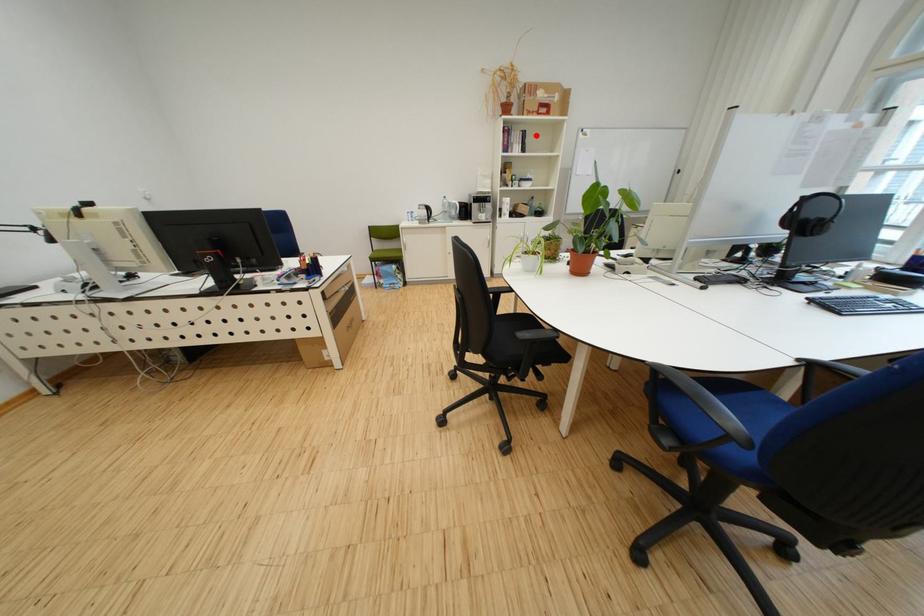
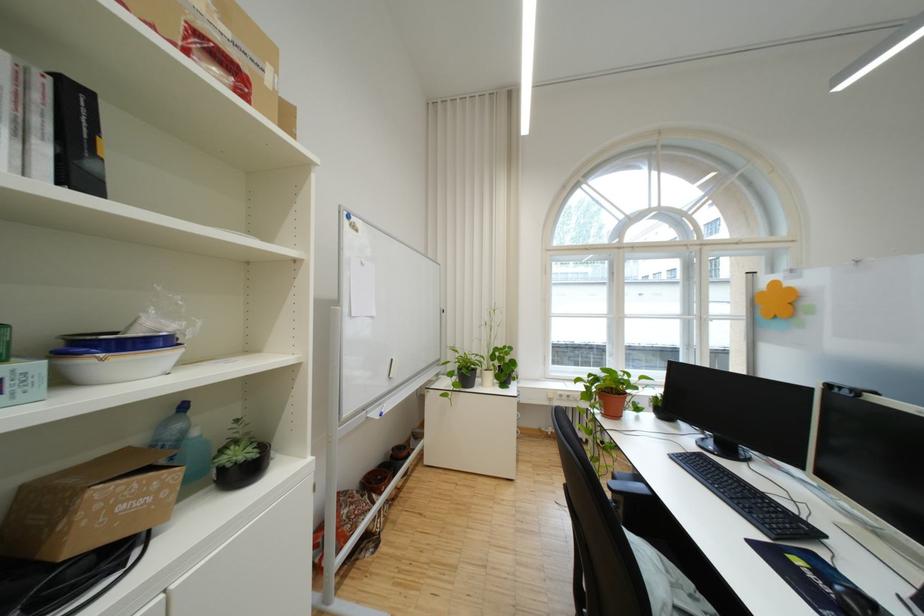
Find the pixel in the second image that matches the highlighted location in the first image.

(88, 100)